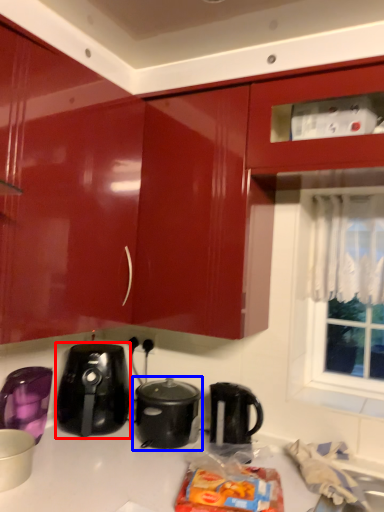
Question: Which of the following is the closest to the observer, home appliance (highlighted by a red box) or slow cooker (highlighted by a blue box)?

Choices:
 (A) home appliance
 (B) slow cooker

Answer: (B)